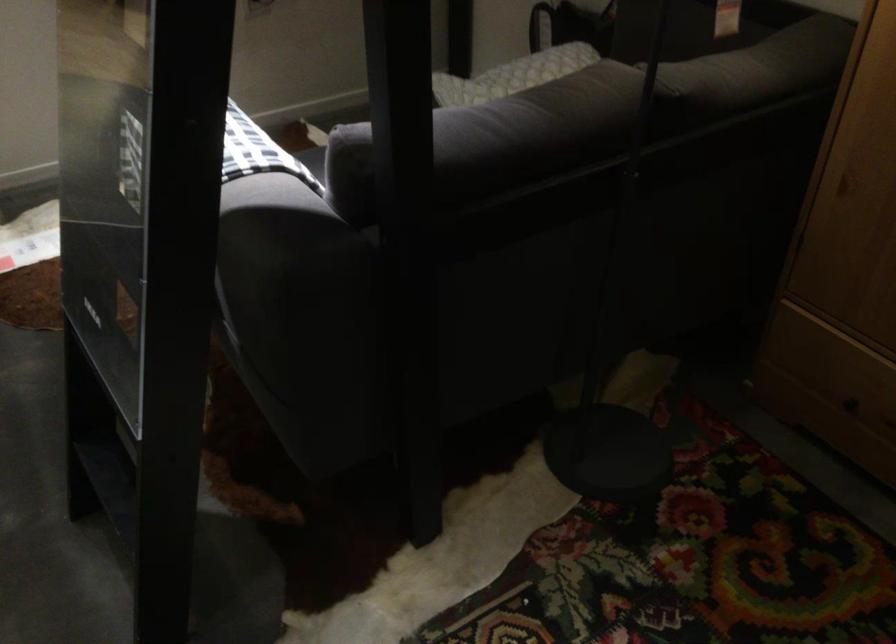
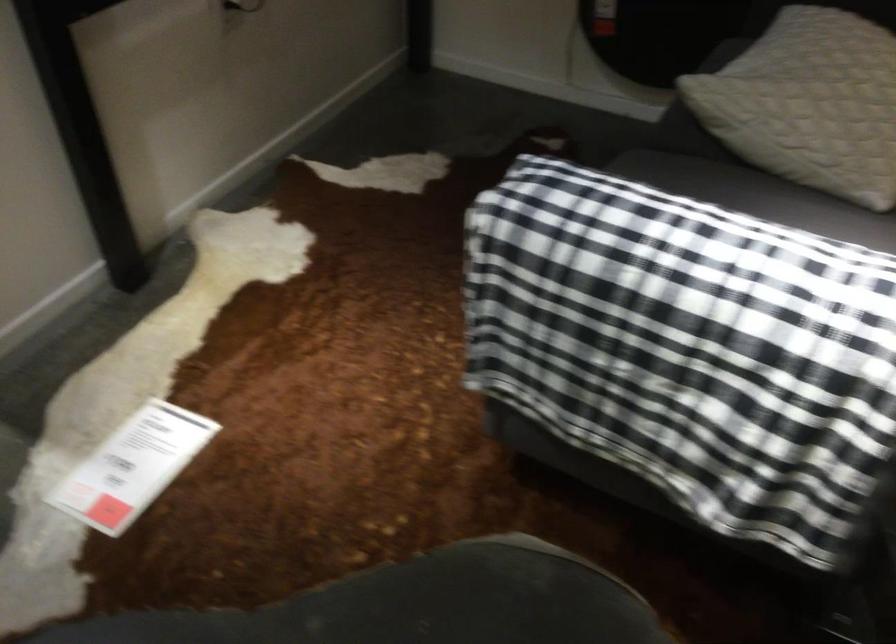
The images are taken continuously from a first-person perspective. In which direction are you moving?

The movement direction of the cameraman is left, forward.